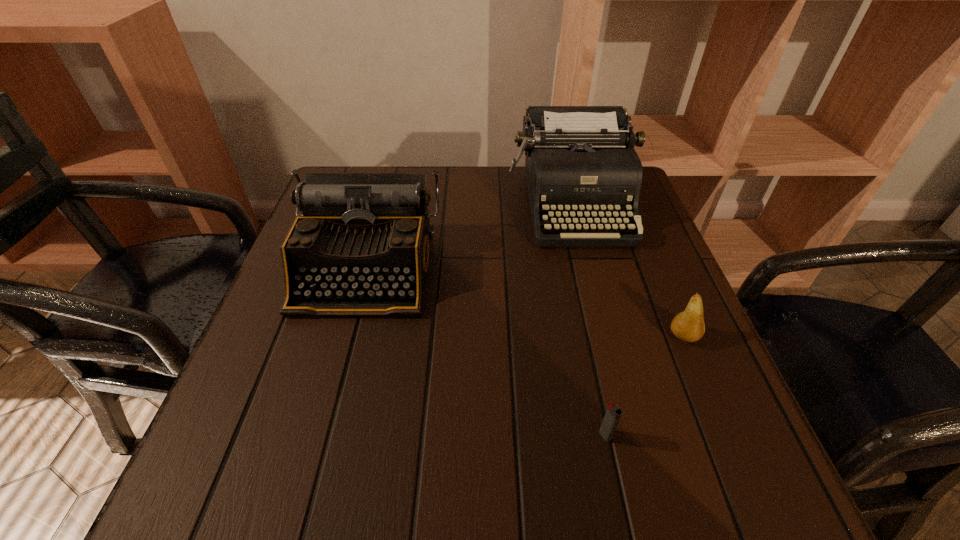
Identify the location of free area in between the right typewriter and the second nearest object. The height and width of the screenshot is (540, 960). (627, 269).

I want to click on free space that is in between the right typewriter and the third tallest object, so click(x=627, y=269).

At what (x,y) coordinates should I click in order to perform the action: click on blank region between the second nearest object and the left typewriter. Please return your answer as a coordinate pair (x, y). Image resolution: width=960 pixels, height=540 pixels. Looking at the image, I should click on (524, 302).

Locate an element on the screen. The image size is (960, 540). free space between the pear and the igniter is located at coordinates (644, 386).

You are a GUI agent. You are given a task and a screenshot of the screen. Output one action in this format:
    pyautogui.click(x=<x>, y=<y>)
    Task: Click on the free space that is in between the leftmost object and the igniter
    This screenshot has height=540, width=960.
    Given the screenshot: What is the action you would take?
    (x=486, y=352)

The height and width of the screenshot is (540, 960). Find the location of `free space that is in between the leftmost object and the igniter`. free space that is in between the leftmost object and the igniter is located at coordinates (486, 352).

Where is `free space that is in between the right typewriter and the pear`? The width and height of the screenshot is (960, 540). free space that is in between the right typewriter and the pear is located at coordinates (627, 269).

The width and height of the screenshot is (960, 540). Identify the location of vacant point located between the right typewriter and the left typewriter. (468, 235).

Identify the location of vacant space that is in between the shortest object and the third farthest object. (644, 386).

Locate which object ranks in proximity to the right typewriter. Please provide its 2D coordinates. Your answer should be formatted as a tuple, i.e. [(x, y)], where the tuple contains the x and y coordinates of a point satisfying the conditions above.

[(361, 246)]